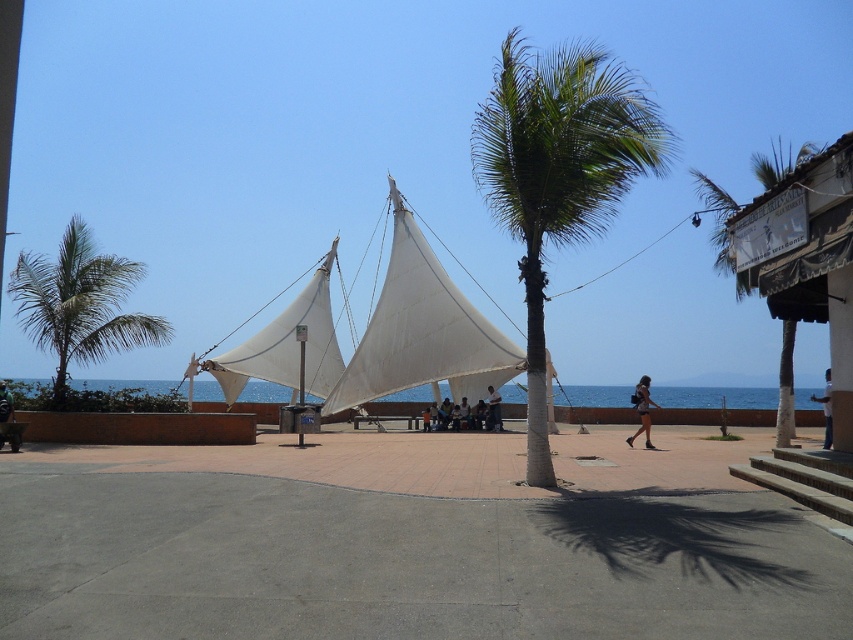
Question: Which of the following is the farthest from the observer?

Choices:
 (A) dark blue jeans at center
 (B) white cotton shirt at center
 (C) matte white tent at center

Answer: (C)

Question: Is white fabric sail at center positioned at the back of matte black backpack at center?

Choices:
 (A) yes
 (B) no

Answer: (A)

Question: Based on their relative distances, which object is farther from the matte black backpack at center?

Choices:
 (A) dark blue jeans at center
 (B) green leafy palm tree at center
 (C) white cotton shirt at center

Answer: (B)

Question: Is the position of white cotton shirt at center more distant than that of dark blue jeans at center?

Choices:
 (A) yes
 (B) no

Answer: (B)

Question: Is green leafy palm tree at left positioned before white cotton shirt at center?

Choices:
 (A) no
 (B) yes

Answer: (A)

Question: Which object is closer to the camera taking this photo?

Choices:
 (A) dark blue jeans at center
 (B) white fabric sail at center
 (C) white cotton shirt at center

Answer: (C)